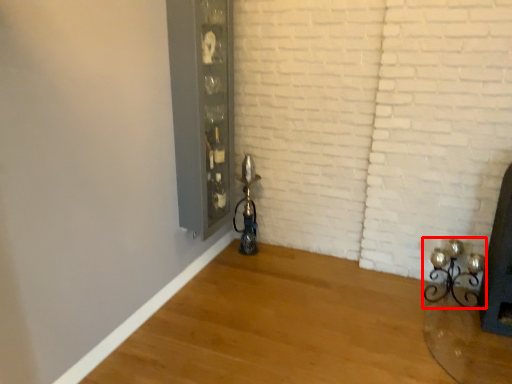
Question: Considering the relative positions of candle holder (annotated by the red box) and glass door in the image provided, where is candle holder (annotated by the red box) located with respect to the staircase?

Choices:
 (A) right
 (B) left

Answer: (A)